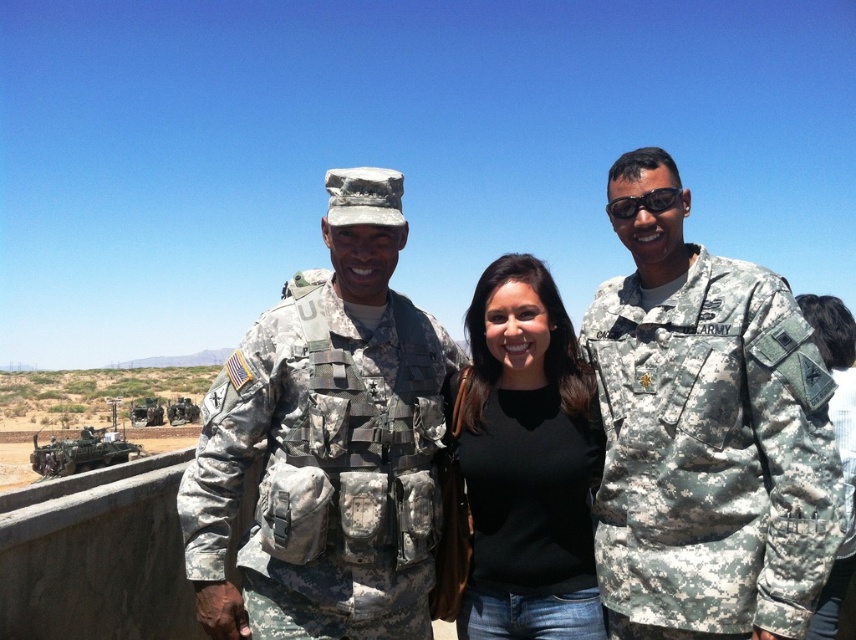
Question: Does camouflage fabric uniform at center have a larger size compared to black matte shirt at center?

Choices:
 (A) no
 (B) yes

Answer: (B)

Question: Which object appears farthest from the camera in this image?

Choices:
 (A) black matte shirt at center
 (B) camouflage uniform at center
 (C) camouflage fabric uniform at center
 (D) camouflage fabric uniform at right

Answer: (A)

Question: Can you confirm if camouflage fabric uniform at right is wider than camouflage fabric uniform at center?

Choices:
 (A) no
 (B) yes

Answer: (A)

Question: Estimate the real-world distances between objects in this image. Which object is closer to the camouflage fabric uniform at center?

Choices:
 (A) camouflage fabric uniform at right
 (B) black matte shirt at center

Answer: (B)

Question: Among these points, which one is farthest from the camera?

Choices:
 (A) (703, 257)
 (B) (783, 323)

Answer: (A)

Question: Can you confirm if camouflage fabric uniform at center is positioned above black matte shirt at center?

Choices:
 (A) no
 (B) yes

Answer: (B)